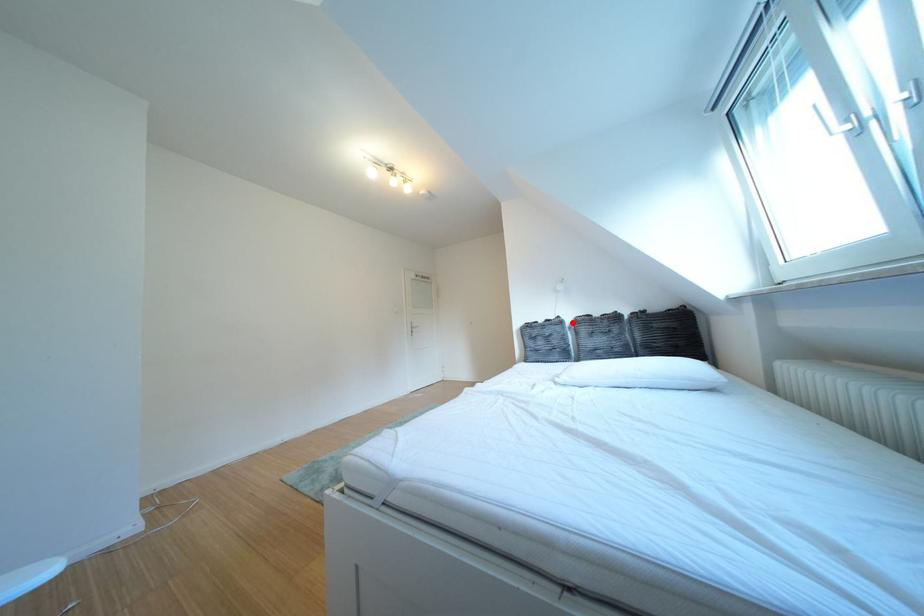
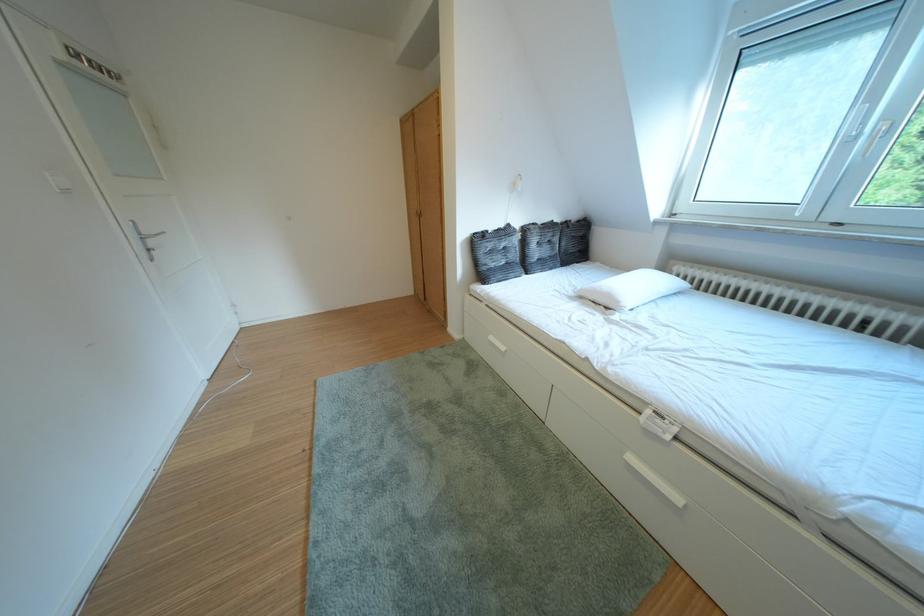
Question: I am providing you with two images of the same scene from different viewpoints. A red point is shown in image1. For the corresponding object point in image2, is it positioned nearer or farther from the camera?

Choices:
 (A) Nearer
 (B) Farther

Answer: (A)